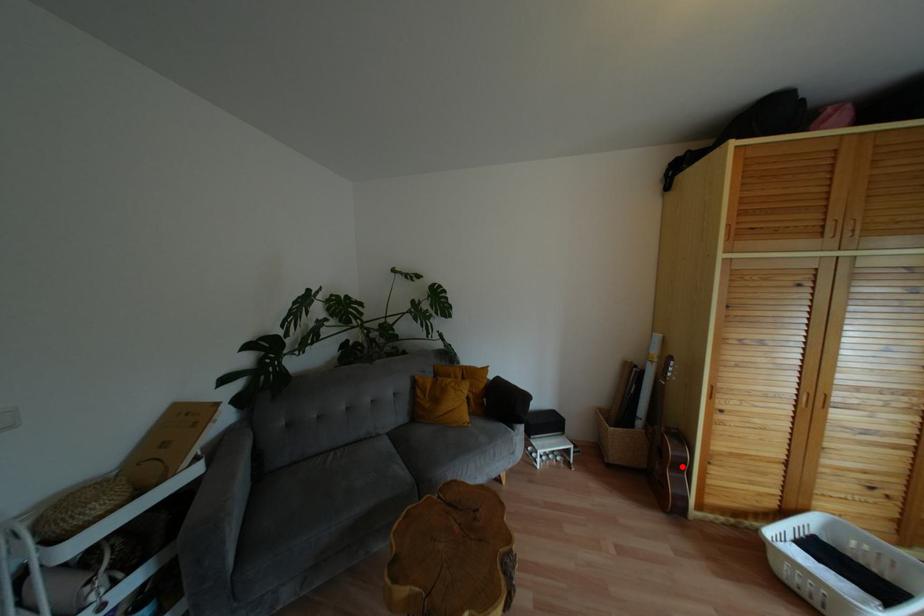
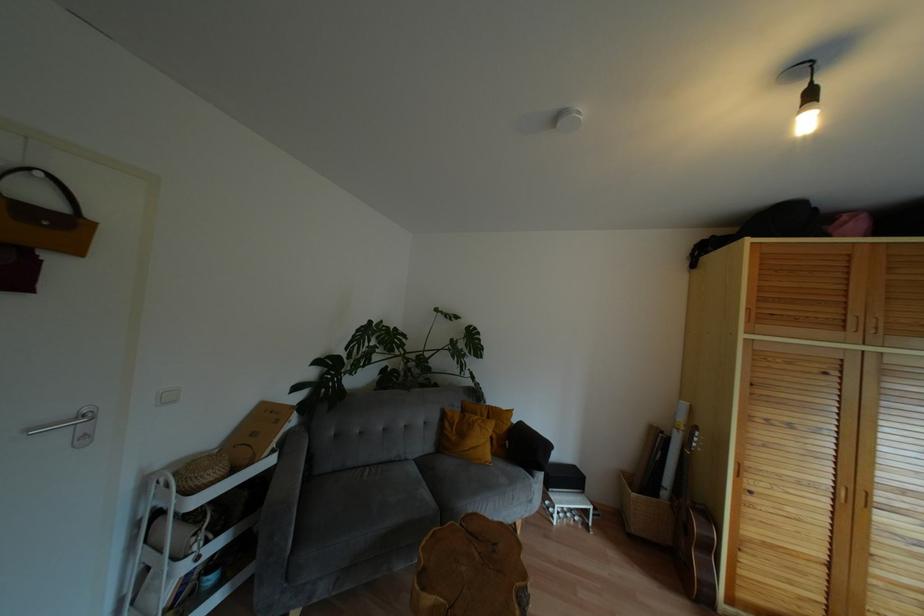
Locate, in the second image, the point that corresponds to the highlighted location in the first image.

(710, 548)